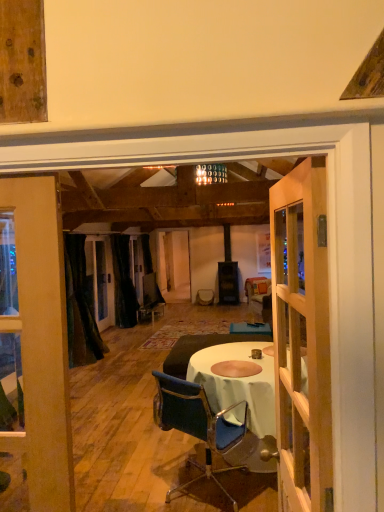
Question: Looking at the image, does wooden door at center seem bigger or smaller compared to clear glass window at left?

Choices:
 (A) big
 (B) small

Answer: (B)

Question: Is wooden door at center inside the boundaries of clear glass window at left, or outside?

Choices:
 (A) inside
 (B) outside

Answer: (B)

Question: Estimate the real-world distances between objects in this image. Which object is farther from the wooden door at center?

Choices:
 (A) blue fabric chair at center
 (B) black velvet curtain at center, which is counted as the first curtain, starting from the back
 (C) dark brown leather couch at center
 (D) clear glass window at left
 (E) black velvet curtain at left, which is the 2th curtain from back to front

Answer: (B)

Question: Considering the real-world distances, which object is farthest from the dark brown leather couch at center?

Choices:
 (A) blue fabric chair at center
 (B) black velvet curtain at left, which is the 2th curtain from back to front
 (C) wooden door at center
 (D) black velvet curtain at center, which is counted as the first curtain, starting from the back
 (E) clear glass window at left

Answer: (D)